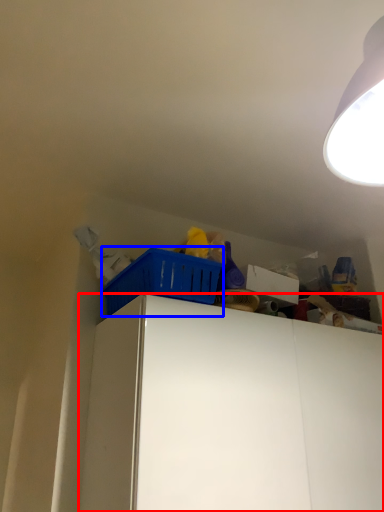
Question: Which point is further to the camera, cabinetry (highlighted by a red box) or basket (highlighted by a blue box)?

Choices:
 (A) cabinetry
 (B) basket

Answer: (B)